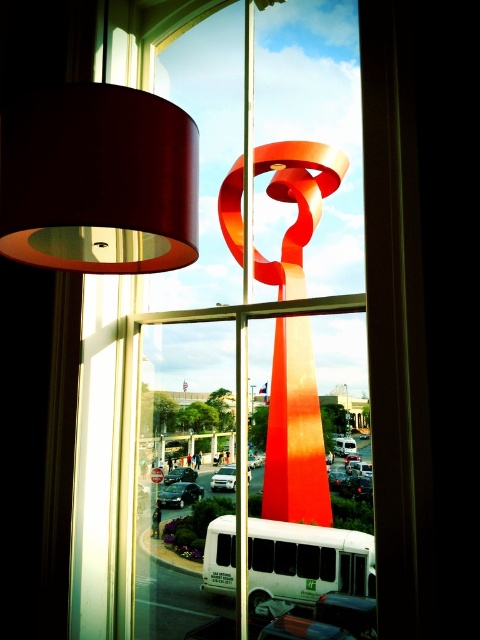
This screenshot has width=480, height=640. Describe the element at coordinates (98, 180) in the screenshot. I see `matte brown lampshade at upper left` at that location.

Is point (47, 252) behind point (304, 468)?

No, it is not.

The image size is (480, 640). I want to click on matte brown lampshade at upper left, so tap(98, 180).

Is matte glass window at center positioned in front of matte brown lampshade at upper left?

That is False.

Can you confirm if matte glass window at center is wider than matte brown lampshade at upper left?

Yes.

Locate an element on the screen. The image size is (480, 640). matte glass window at center is located at coordinates (159, 342).

Locate an element on the screen. This screenshot has height=640, width=480. matte glass window at center is located at coordinates (159, 342).

Is point (253, 385) less distant than point (299, 200)?

No, it is not.

Between matte glass window at center and shiny orange ribbon at center, which one is positioned lower?

Positioned lower is matte glass window at center.

Does point (146, 481) come farther from viewer compared to point (324, 524)?

No, it is in front of (324, 524).

Where is `matte glass window at center`? matte glass window at center is located at coordinates (159, 342).